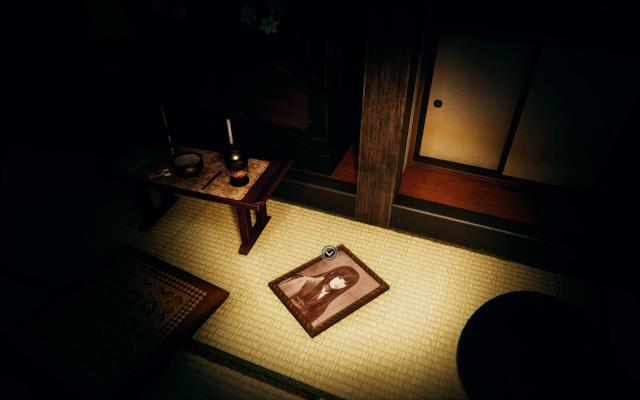
Image resolution: width=640 pixels, height=400 pixels. I want to click on little table, so click(217, 181).